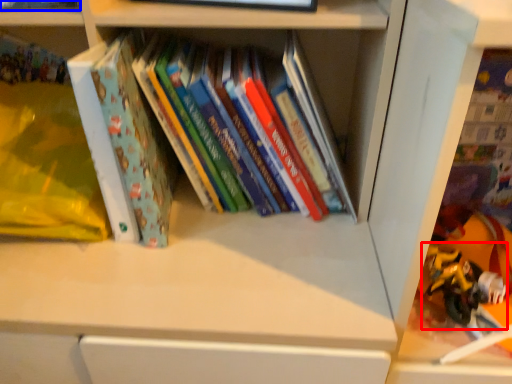
Question: Which object is closer to the camera taking this photo, toy (highlighted by a red box) or book (highlighted by a blue box)?

Choices:
 (A) toy
 (B) book

Answer: (B)